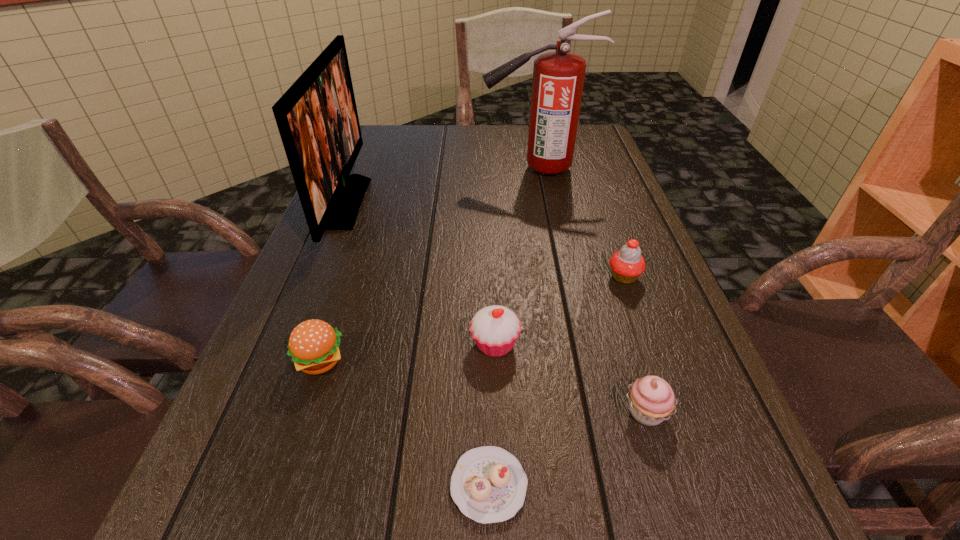
The height and width of the screenshot is (540, 960). I want to click on vacant space located 0.240m at the nozzle of the tallest object, so click(399, 169).

You are a GUI agent. You are given a task and a screenshot of the screen. Output one action in this format:
    pyautogui.click(x=<x>, y=<y>)
    Task: Click on the free location located at the nozzle of the tallest object
    
    Given the screenshot: What is the action you would take?
    pyautogui.click(x=375, y=169)

Locate an element on the screen. vacant position located 0.050m on the front-facing side of the sixth shortest object is located at coordinates (382, 203).

The width and height of the screenshot is (960, 540). What are the coordinates of `vacant space located 0.300m on the front of the farthest cupcake` in the screenshot? It's located at (676, 422).

Where is `free region located on the back of the third nearest cupcake`? free region located on the back of the third nearest cupcake is located at coordinates (492, 231).

Where is `vacant space situated 0.140m on the back of the hamburger`? The height and width of the screenshot is (540, 960). vacant space situated 0.140m on the back of the hamburger is located at coordinates (345, 288).

Locate an element on the screen. The image size is (960, 540). vacant region located 0.100m on the left of the third tallest cupcake is located at coordinates click(559, 412).

Identify the location of blank space located on the left of the nearest object. (372, 485).

Where is `monitor at the left edge`? monitor at the left edge is located at coordinates (317, 119).

Where is `hamburger present at the left edge`? hamburger present at the left edge is located at coordinates (314, 345).